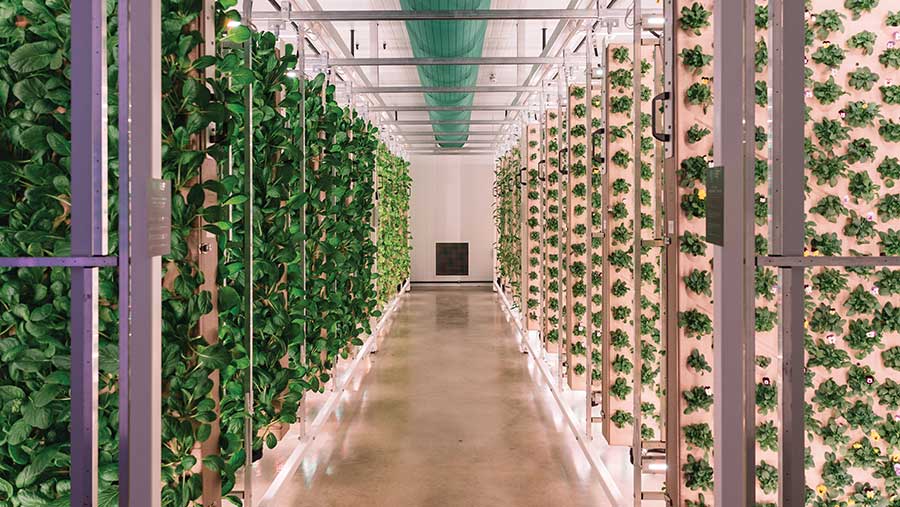
At what (x,y) coordinates should I click in order to perform the action: click on ceiling. Please return your answer as a coordinate pair (x, y). The image size is (900, 507). Looking at the image, I should click on (496, 35).